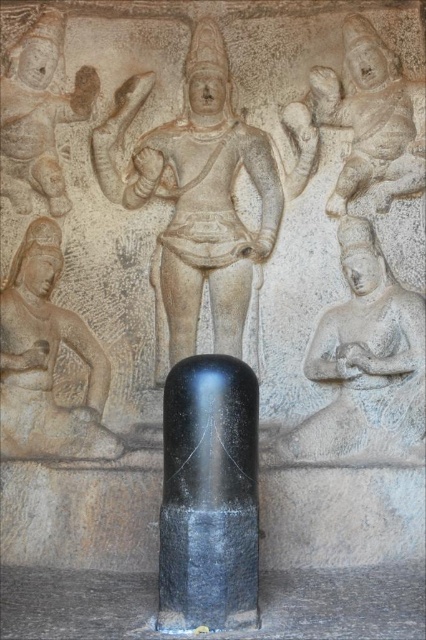
You are an archaeologist examining the stone carving relief. You notice a specific point marked at coordinates (195,198). Based on the scene description, where is this point located?

The point at coordinates (195,198) is located on the stone statue at center.